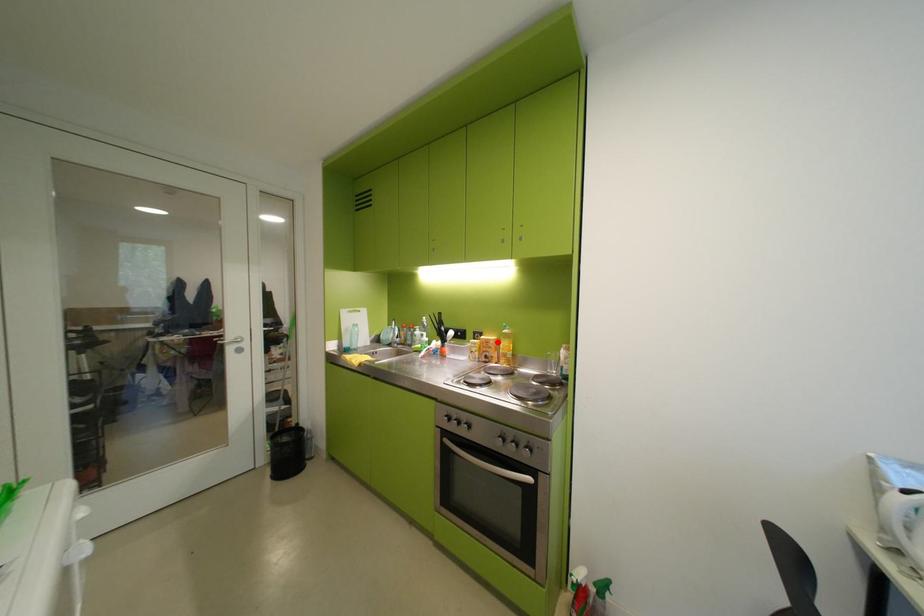
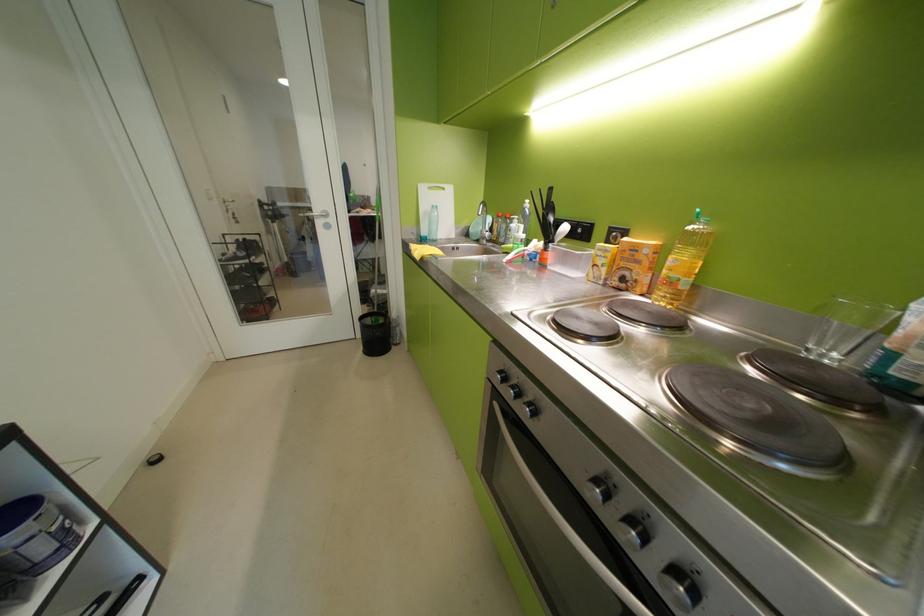
Find the pixel in the second image that matches the highlighted location in the first image.

(646, 249)